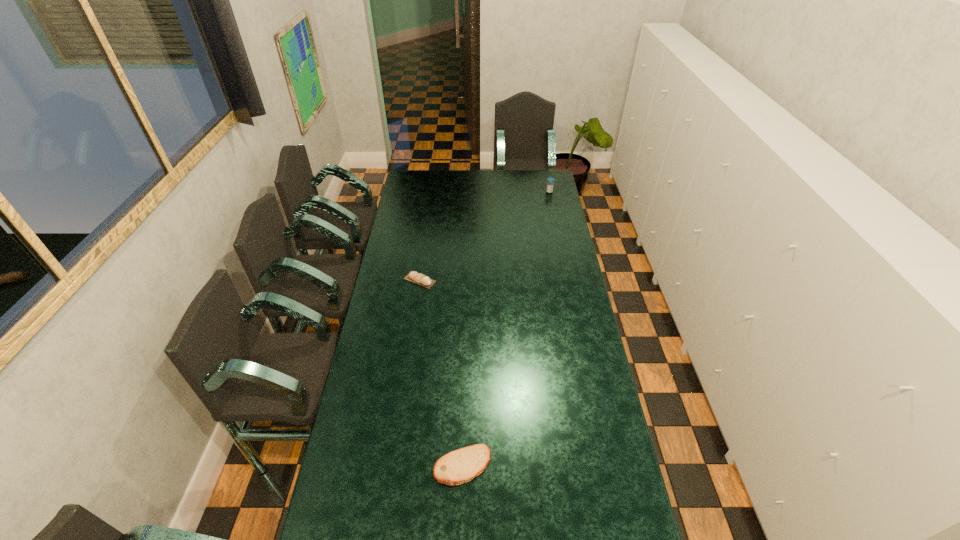
This screenshot has width=960, height=540. I want to click on blank region between the right pita bread and the rightmost object, so click(506, 328).

Where is `vacant area between the right pita bread and the rightmost object`? The width and height of the screenshot is (960, 540). vacant area between the right pita bread and the rightmost object is located at coordinates (506, 328).

Image resolution: width=960 pixels, height=540 pixels. Identify the location of free spot between the right pita bread and the leftmost object. (442, 373).

Identify the location of vacant space that is in between the farthest object and the nearest object. (506, 328).

Find the location of a particular element. The image size is (960, 540). free point between the rightmost object and the second farthest object is located at coordinates (485, 236).

What are the coordinates of `free space that is in between the rightmost object and the second object from left to right` in the screenshot? It's located at (506, 328).

I want to click on free space that is in between the second farthest object and the right pita bread, so click(x=442, y=373).

Identify which object is located as the nearest to the farther pita bread. Please provide its 2D coordinates. Your answer should be formatted as a tuple, i.e. [(x, y)], where the tuple contains the x and y coordinates of a point satisfying the conditions above.

[(460, 466)]

Point out which object is positioned as the nearest to the leftmost object. Please provide its 2D coordinates. Your answer should be formatted as a tuple, i.e. [(x, y)], where the tuple contains the x and y coordinates of a point satisfying the conditions above.

[(460, 466)]

You are a GUI agent. You are given a task and a screenshot of the screen. Output one action in this format:
    pyautogui.click(x=<x>, y=<y>)
    Task: Click on the vacant region that satisfies the following two spatial constraints: 1. on the back side of the farthest object; 2. on the left side of the farther pita bread
    The image size is (960, 540).
    Given the screenshot: What is the action you would take?
    pyautogui.click(x=433, y=192)